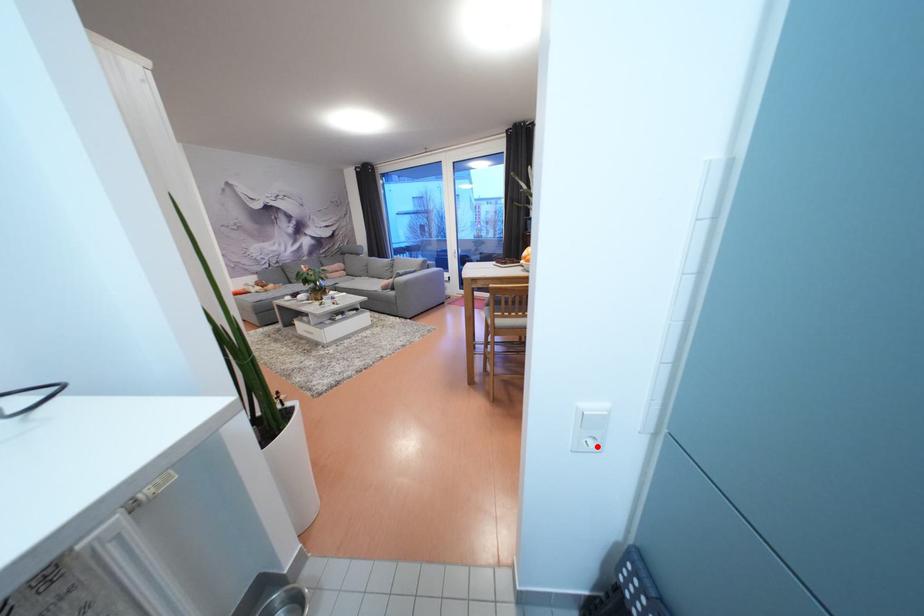
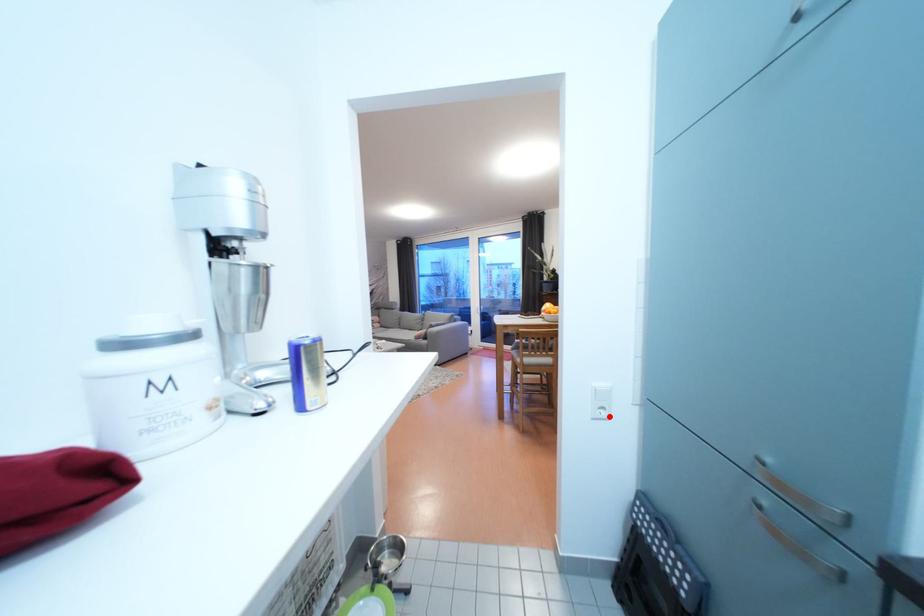
I am providing you with two images of the same scene from different viewpoints. A red point is marked on the first image and another point is marked on the second image. Is the red point in image1 aligned with the point shown in image2?

Yes